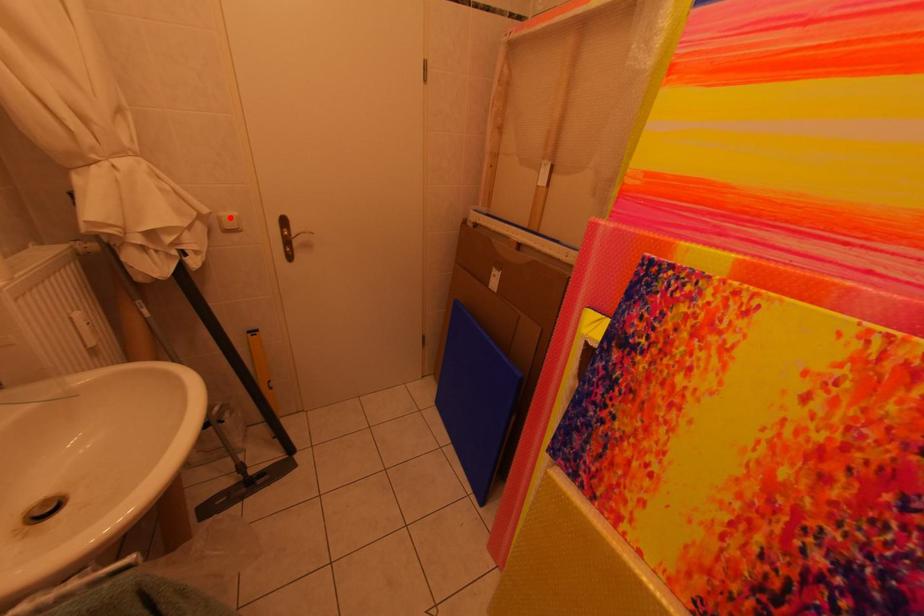
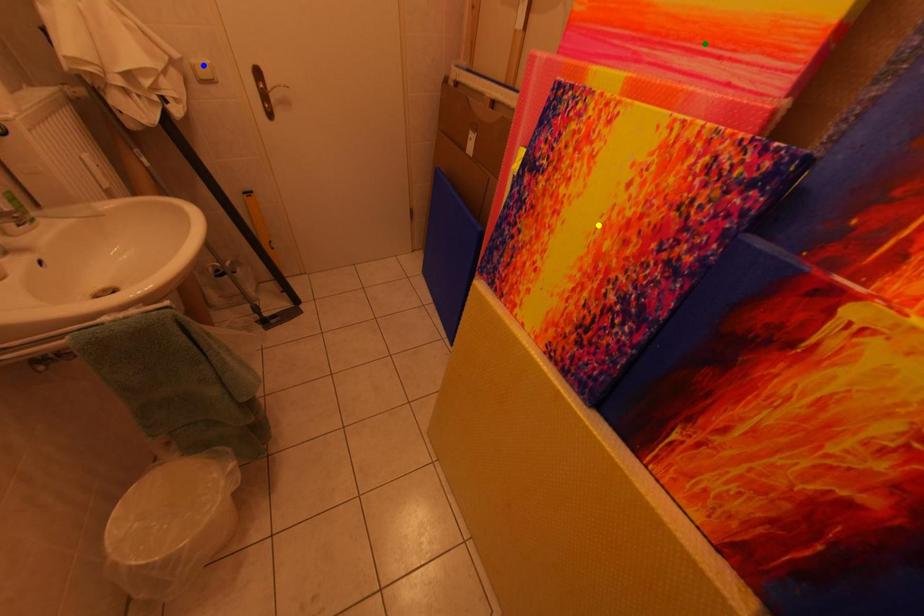
Question: I am providing you with two images of the same scene from different viewpoints. A red point is marked on the first image. You are given multiple points on the second image. Can you choose the point in image 2 that corresponds to the point in image 1?

Choices:
 (A) yellow point
 (B) blue point
 (C) green point

Answer: (B)